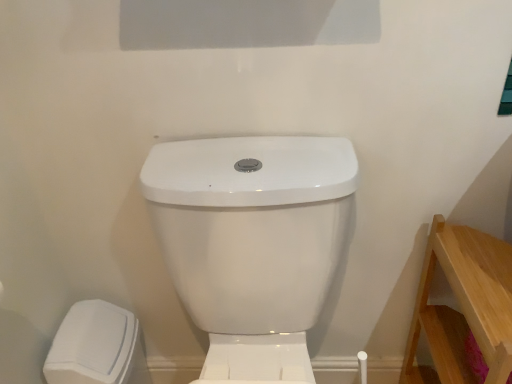
Question: Do you think white matte trash can at lower left is within light wood/rough wooden stool at lower right, or outside of it?

Choices:
 (A) outside
 (B) inside

Answer: (A)

Question: Considering the positions of point (133, 370) and point (490, 336), is point (133, 370) closer or farther from the camera than point (490, 336)?

Choices:
 (A) closer
 (B) farther

Answer: (B)

Question: Based on their relative distances, which object is farther from the white glossy toilet at center?

Choices:
 (A) white matte trash can at lower left
 (B) light wood/rough wooden stool at lower right

Answer: (A)

Question: Considering the real-world distances, which object is farthest from the white matte trash can at lower left?

Choices:
 (A) light wood/rough wooden stool at lower right
 (B) white glossy toilet at center

Answer: (A)